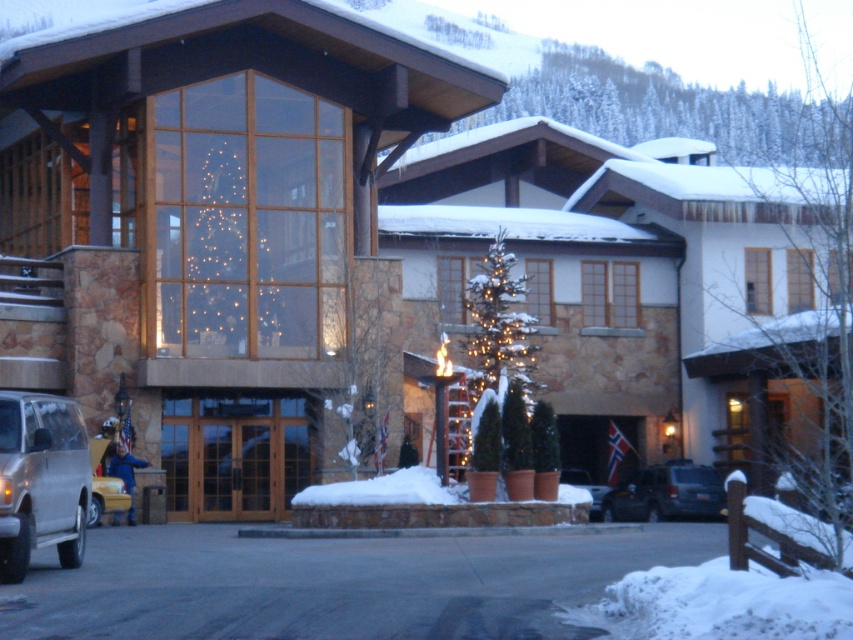
Which of these two, white fluffy snow at center or matte silver suv at center, stands taller?

matte silver suv at center

The image size is (853, 640). I want to click on white fluffy snow at center, so click(x=386, y=490).

Image resolution: width=853 pixels, height=640 pixels. What are the coordinates of `white fluffy snow at center` in the screenshot? It's located at (386, 490).

Is point (86, 436) more distant than point (583, 476)?

No, (86, 436) is closer to viewer.

Between gold metallic suv at lower left and matte silver suv at center, which one has more height?

Standing taller between the two is matte silver suv at center.

You are a GUI agent. You are given a task and a screenshot of the screen. Output one action in this format:
    pyautogui.click(x=<x>, y=<y>)
    Task: Click on the gold metallic suv at lower left
    The width and height of the screenshot is (853, 640).
    Given the screenshot: What is the action you would take?
    pyautogui.click(x=39, y=481)

Is dark gray suv at center above white fluffy snow at center?

Incorrect, dark gray suv at center is not positioned above white fluffy snow at center.

Find the location of `dark gray suv at center`. dark gray suv at center is located at coordinates (665, 493).

Identify the location of dark gray suv at center. This screenshot has height=640, width=853. (665, 493).